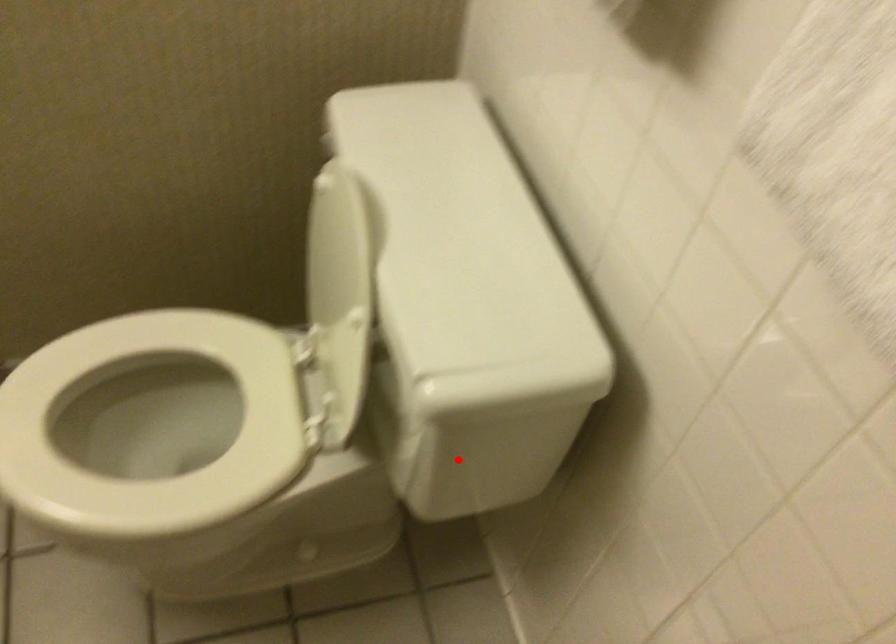
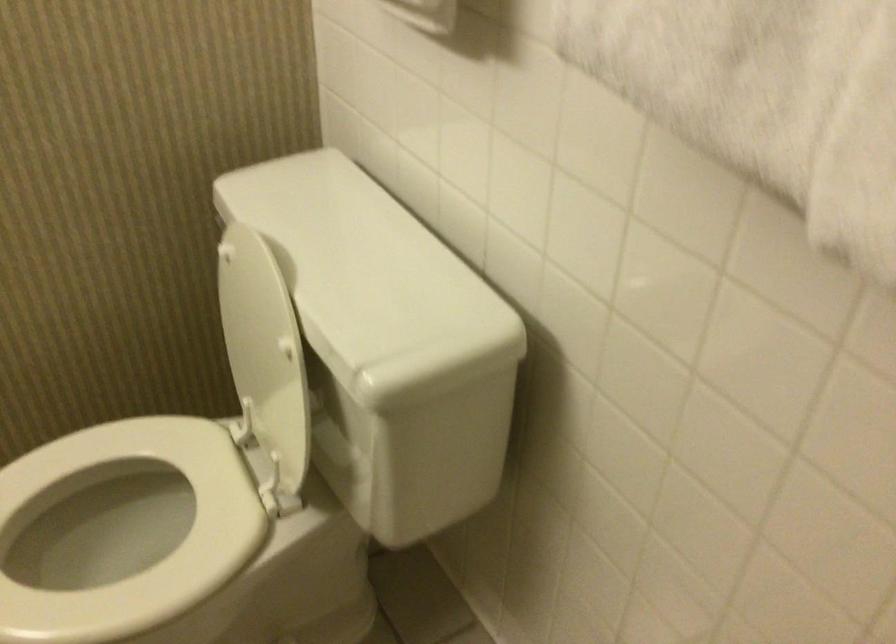
Where in the second image is the point corresponding to the highlighted location from the first image?

(411, 451)